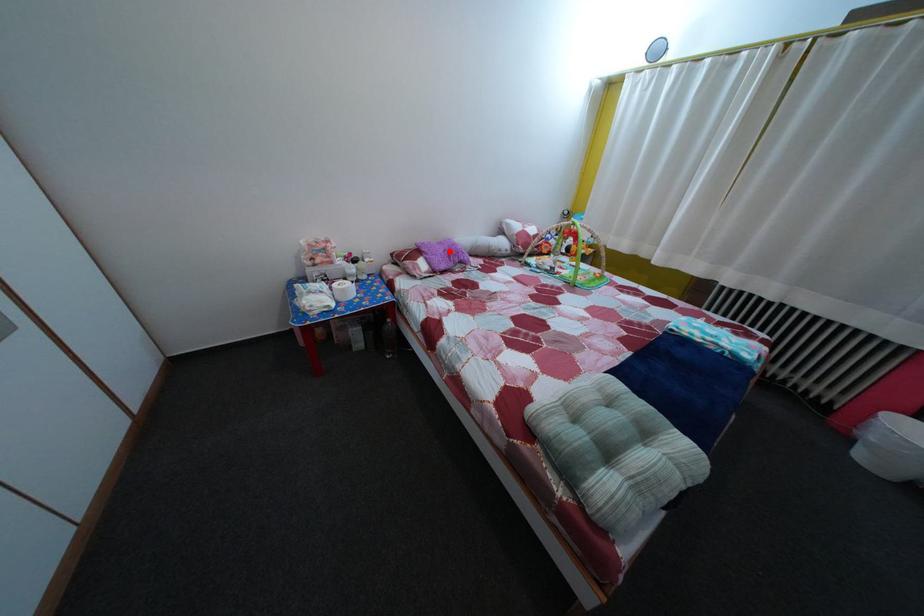
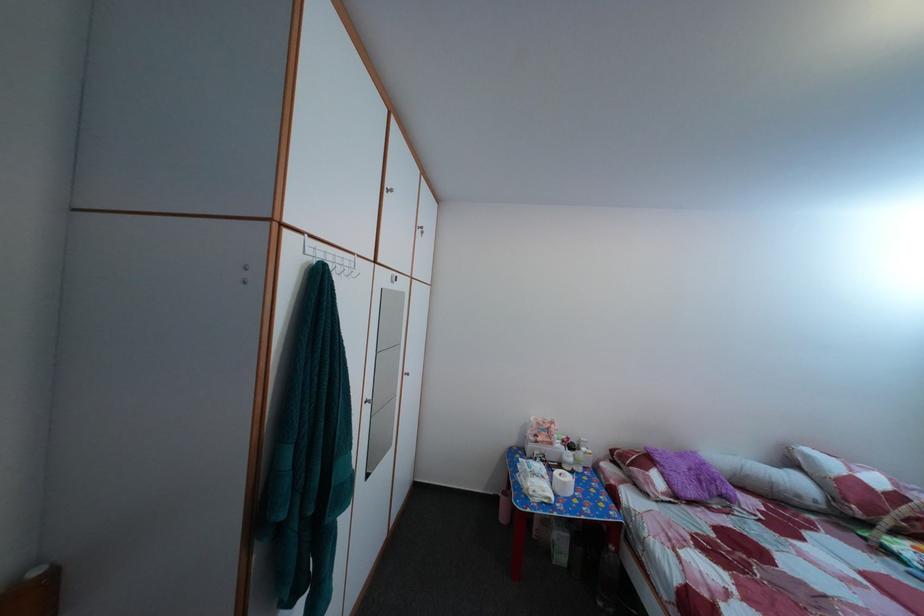
Question: A red point is marked in image1. In image2, is the corresponding 3D point closer to the camera or farther? Reply with the corresponding letter.

Choices:
 (A) The corresponding 3D point is closer.
 (B) The corresponding 3D point is farther.

Answer: (B)